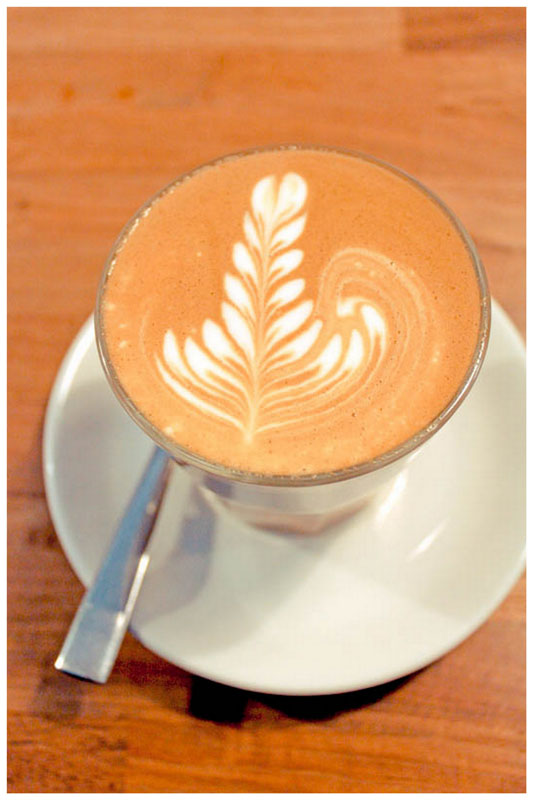
Identify the location of white plate. (247, 597).